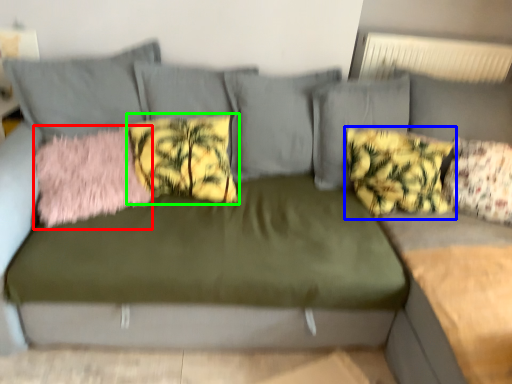
Question: Estimate the real-world distances between objects in this image. Which object is farther from pillow (highlighted by a red box), pillow (highlighted by a blue box) or pillow (highlighted by a green box)?

Choices:
 (A) pillow
 (B) pillow

Answer: (A)